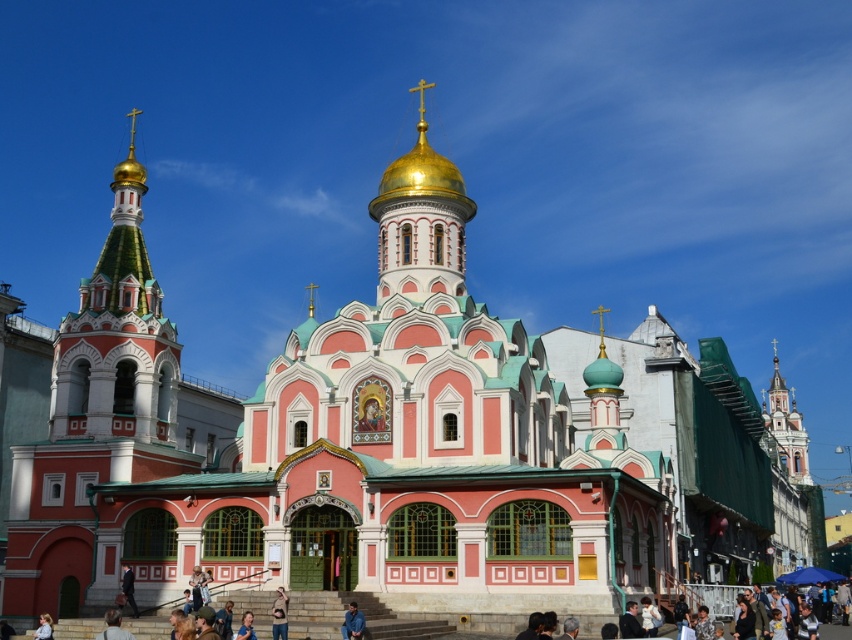
You are a photographer standing in front of the church. You want to take a photo that includes both the blue denim jeans at lower center and the dark brown leather coat at lower left. However, your camera has a limited field of view. Based on their positions, will you be able to fit both objects into the frame without moving the camera?

The blue denim jeans at lower center might be wider than dark brown leather coat at lower left, so it depends on the exact width of both objects. If the total width of both objects combined is within the camera field of view, then yes. Otherwise, no.

You are standing at the entrance of the church and notice two points marked on the ground. The first point is at coordinate point (354, 616) and the second point is at coordinate point (130, 566). From your position at the entrance, which point is closer to you?

Point (354, 616) is in front of point (130, 566), so the point closer to you at the entrance is point (354, 616).

Based on the scene description, where is the light brown hair at lower center located in terms of its 2D coordinates?

The light brown hair at lower center is located at the 2D coordinates of point (113, 627).